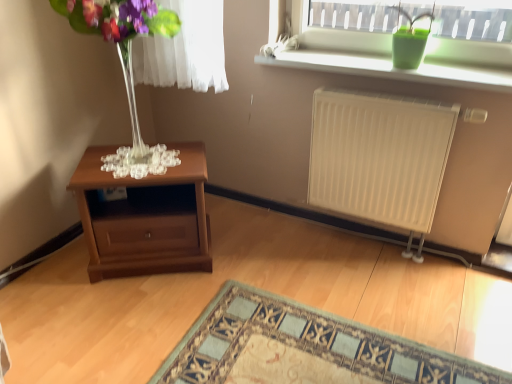
This screenshot has width=512, height=384. What are the coordinates of `carpet with intricate pattern at lower center` in the screenshot? It's located at (308, 344).

What do you see at coordinates (410, 40) in the screenshot?
I see `green matte pot at upper right` at bounding box center [410, 40].

The width and height of the screenshot is (512, 384). Identify the location of green matte pot at upper right. (410, 40).

In order to face green matte vase at upper right, should I rotate leftwards or rightwards?

To face it directly, rotate right by 17.643 degrees.

Describe the element at coordinates (381, 63) in the screenshot. This screenshot has width=512, height=384. I see `green matte vase at upper right` at that location.

At what (x,y) coordinates should I click in order to perform the action: click on carpet with intricate pattern at lower center. Please return your answer as a coordinate pair (x, y). The height and width of the screenshot is (384, 512). Looking at the image, I should click on (308, 344).

From the image's perspective, is mahogany wood nightstand at lower left above or below white matte radiator at right?

mahogany wood nightstand at lower left is below white matte radiator at right.

Is mahogany wood nightstand at lower left looking in the opposite direction of white matte radiator at right?

No, mahogany wood nightstand at lower left is not facing the opposite direction of white matte radiator at right.

Considering the relative sizes of mahogany wood nightstand at lower left and white matte radiator at right in the image provided, is mahogany wood nightstand at lower left taller than white matte radiator at right?

No, mahogany wood nightstand at lower left is not taller than white matte radiator at right.

In terms of width, does mahogany wood nightstand at lower left look wider or thinner when compared to green matte vase at upper right?

Clearly, mahogany wood nightstand at lower left has more width compared to green matte vase at upper right.

From a real-world perspective, between mahogany wood nightstand at lower left and green matte vase at upper right, who is vertically lower?

mahogany wood nightstand at lower left is physically lower.

In the image, is mahogany wood nightstand at lower left positioned in front of or behind green matte vase at upper right?

In the image, mahogany wood nightstand at lower left appears behind green matte vase at upper right.

Where is `houseplant to the right of green matte vase at upper right`? This screenshot has height=384, width=512. houseplant to the right of green matte vase at upper right is located at coordinates (410, 40).

Who is smaller, green matte vase at upper right or green matte pot at upper right?

With smaller size is green matte pot at upper right.

Is green matte vase at upper right wider or thinner than green matte pot at upper right?

Clearly, green matte vase at upper right has less width compared to green matte pot at upper right.

Which object is closer to the camera taking this photo, green matte vase at upper right or transparent glass vase at left?

transparent glass vase at left is more forward.

Can you confirm if green matte vase at upper right is smaller than transparent glass vase at left?

Correct, green matte vase at upper right occupies less space than transparent glass vase at left.

From the picture: Is green matte vase at upper right wider than transparent glass vase at left?

Incorrect, the width of green matte vase at upper right does not surpass that of transparent glass vase at left.

Where is `window located above the transparent glass vase at left (from a real-world perspective)`? This screenshot has height=384, width=512. window located above the transparent glass vase at left (from a real-world perspective) is located at coordinates (381, 63).

From the picture: How far apart are carpet with intricate pattern at lower center and mahogany wood nightstand at lower left?

The distance of carpet with intricate pattern at lower center from mahogany wood nightstand at lower left is 21.00 inches.

Is point (358, 368) closer or farther from the camera than point (93, 273)?

Point (358, 368) is positioned closer to the camera compared to point (93, 273).

Between carpet with intricate pattern at lower center and mahogany wood nightstand at lower left, which one has larger width?

With larger width is carpet with intricate pattern at lower center.

Is carpet with intricate pattern at lower center far from mahogany wood nightstand at lower left?

No.

Does green matte vase at upper right turn towards mahogany wood nightstand at lower left?

No, green matte vase at upper right is not oriented towards mahogany wood nightstand at lower left.

Considering the sizes of objects green matte vase at upper right and mahogany wood nightstand at lower left in the image provided, who is shorter, green matte vase at upper right or mahogany wood nightstand at lower left?

Standing shorter between the two is green matte vase at upper right.

Looking at their sizes, would you say green matte vase at upper right is wider or thinner than mahogany wood nightstand at lower left?

In the image, green matte vase at upper right appears to be more narrow than mahogany wood nightstand at lower left.

Which is more to the right, green matte vase at upper right or mahogany wood nightstand at lower left?

From the viewer's perspective, green matte vase at upper right appears more on the right side.

Is white matte radiator at right positioned far away from transparent glass vase at left?

Yes, white matte radiator at right and transparent glass vase at left are located far from each other.

What's the angular difference between white matte radiator at right and transparent glass vase at left's facing directions?

The facing directions of white matte radiator at right and transparent glass vase at left are 34.9 degrees apart.

In the image, is white matte radiator at right on the left side or the right side of transparent glass vase at left?

Based on their positions, white matte radiator at right is located to the right of transparent glass vase at left.

From the image's perspective, is white matte radiator at right located above transparent glass vase at left?

No, from the image's perspective, white matte radiator at right is not over transparent glass vase at left.

Image resolution: width=512 pixels, height=384 pixels. I want to click on table behind the white matte radiator at right, so click(x=145, y=217).

This screenshot has height=384, width=512. Identify the location of window to the right of mahogany wood nightstand at lower left. (381, 63).

From the image, which object appears to be nearer to green matte pot at upper right, transparent glass vase at left or green matte vase at upper right?

Among the two, green matte vase at upper right is located nearer to green matte pot at upper right.

From the image, which object appears to be farther from transparent glass vase at left, carpet with intricate pattern at lower center or green matte vase at upper right?

carpet with intricate pattern at lower center lies further to transparent glass vase at left than the other object.

Estimate the real-world distances between objects in this image. Which object is further from green matte vase at upper right, carpet with intricate pattern at lower center or mahogany wood nightstand at lower left?

Among the two, carpet with intricate pattern at lower center is located further to green matte vase at upper right.

Based on their spatial positions, is carpet with intricate pattern at lower center or mahogany wood nightstand at lower left closer to green matte pot at upper right?

Based on the image, carpet with intricate pattern at lower center appears to be nearer to green matte pot at upper right.

From the picture: Which object lies further to the anchor point mahogany wood nightstand at lower left, transparent glass vase at left or white matte radiator at right?

white matte radiator at right is positioned further to the anchor mahogany wood nightstand at lower left.

Which object lies nearer to the anchor point carpet with intricate pattern at lower center, green matte vase at upper right or mahogany wood nightstand at lower left?

The object closer to carpet with intricate pattern at lower center is mahogany wood nightstand at lower left.

Considering their positions, is white matte radiator at right positioned further to carpet with intricate pattern at lower center than transparent glass vase at left?

transparent glass vase at left.

Considering their positions, is white matte radiator at right positioned closer to green matte vase at upper right than mahogany wood nightstand at lower left?

white matte radiator at right is positioned closer to the anchor green matte vase at upper right.

The image size is (512, 384). What are the coordinates of `radiator between mahogany wood nightstand at lower left and green matte pot at upper right in the horizontal direction` in the screenshot? It's located at (379, 156).

The height and width of the screenshot is (384, 512). In order to click on mat between mahogany wood nightstand at lower left and white matte radiator at right in this screenshot , I will do `click(308, 344)`.

The width and height of the screenshot is (512, 384). In order to click on window situated between mahogany wood nightstand at lower left and green matte pot at upper right from left to right in this screenshot , I will do [381, 63].

The width and height of the screenshot is (512, 384). Find the location of `radiator between green matte vase at upper right and carpet with intricate pattern at lower center in the up-down direction`. radiator between green matte vase at upper right and carpet with intricate pattern at lower center in the up-down direction is located at coordinates (379, 156).